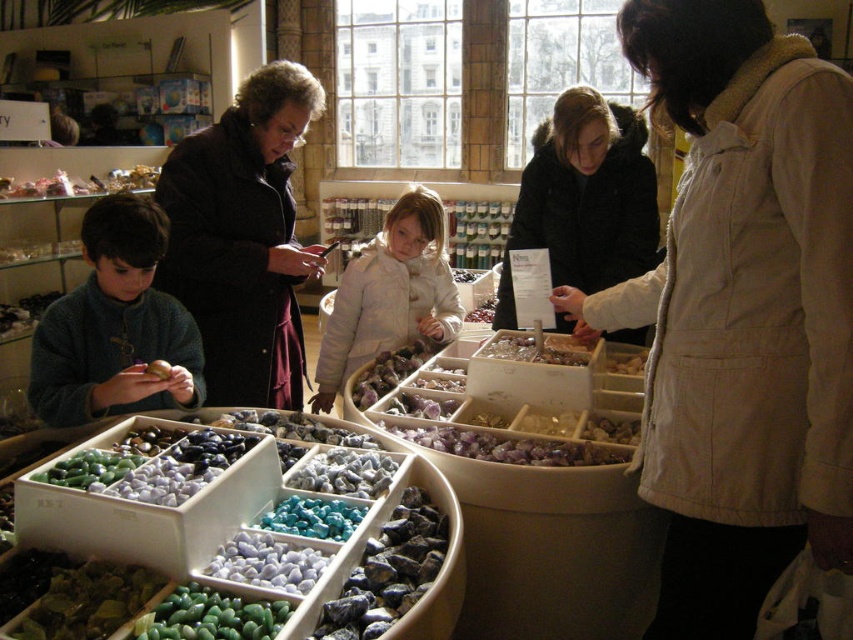
You are a customer in the shop and want to examine the beige cotton vest at center. If you are standing 1 meter away from it, can you comfortably reach out and touch it without moving closer?

The beige cotton vest at center is 1.02 meters away from the viewer, so you are currently standing slightly farther than 1 meter away. To touch it without moving closer would not be possible as the distance is just over 1 meter.

In the scene shown: You are a customer in the shop and want to compare the height of the beige cotton vest at center and the white fuzzy coat at center. Which one is taller?

The beige cotton vest at center is taller than the white fuzzy coat at center according to the description.